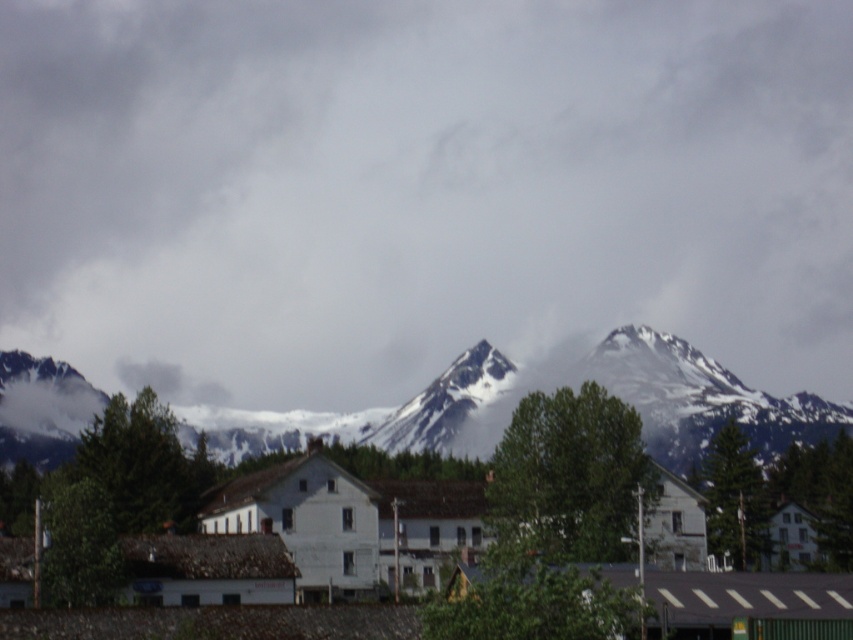
Looking at the scene, which object occupies a larger portion of the image between the cloudy sky at upper center and the snowy rock mountain at center?

The cloudy sky at upper center is bigger than the snowy rock mountain at center, so it occupies a larger portion of the image.

Consider the image. You are an architect planning to build a new observatory in this landscape. You need to choose a location that offers the best view of both the cloudy sky at upper center and the snowy rock mountain at center. Based on their widths, which object would require more horizontal space to fully capture in a photograph?

The cloudy sky at upper center requires more horizontal space to fully capture in a photograph because its width surpasses that of the snowy rock mountain at center.